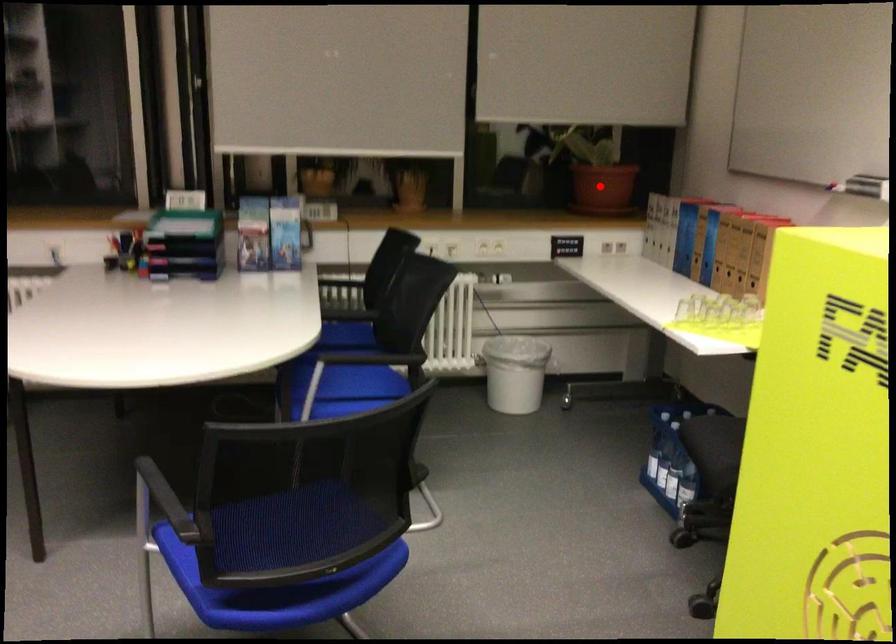
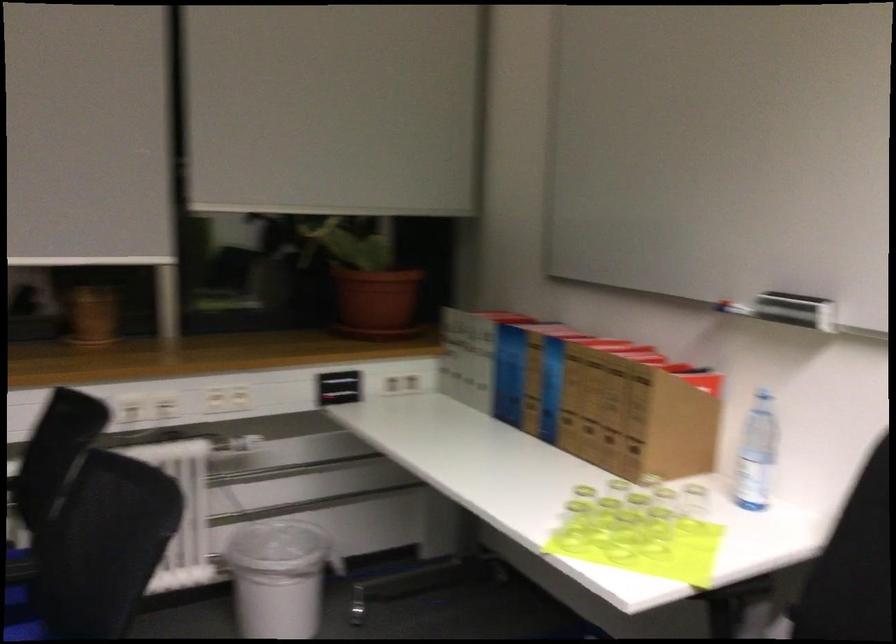
Where in the second image is the point corresponding to the highlighted location from the first image?

(375, 303)